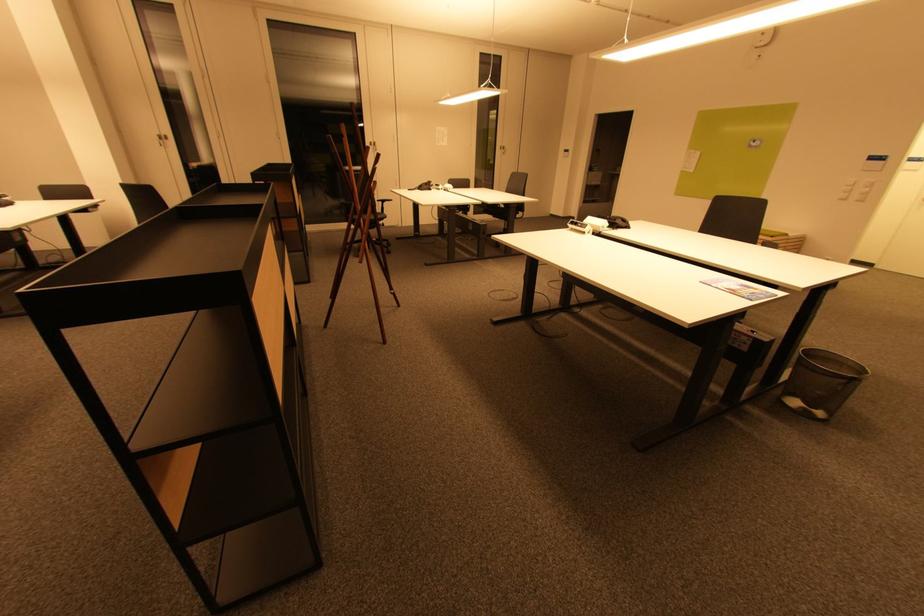
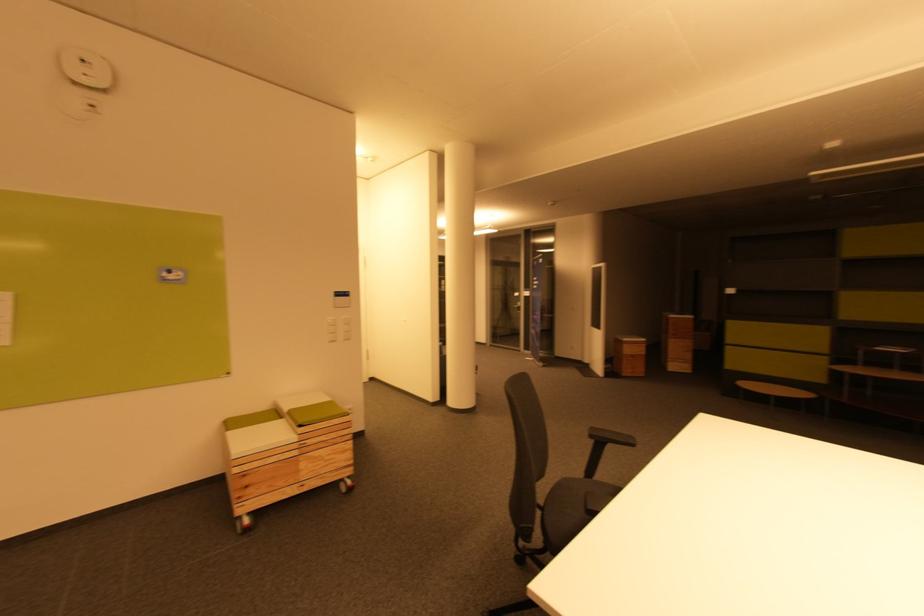
Question: I am providing you with two images of the same scene from different viewpoints. Which of the following objects are not visible in image2?

Choices:
 (A) white light switch
 (B) chair armrest
 (C) metal wastebasket
 (D) black fan controls

Answer: (C)